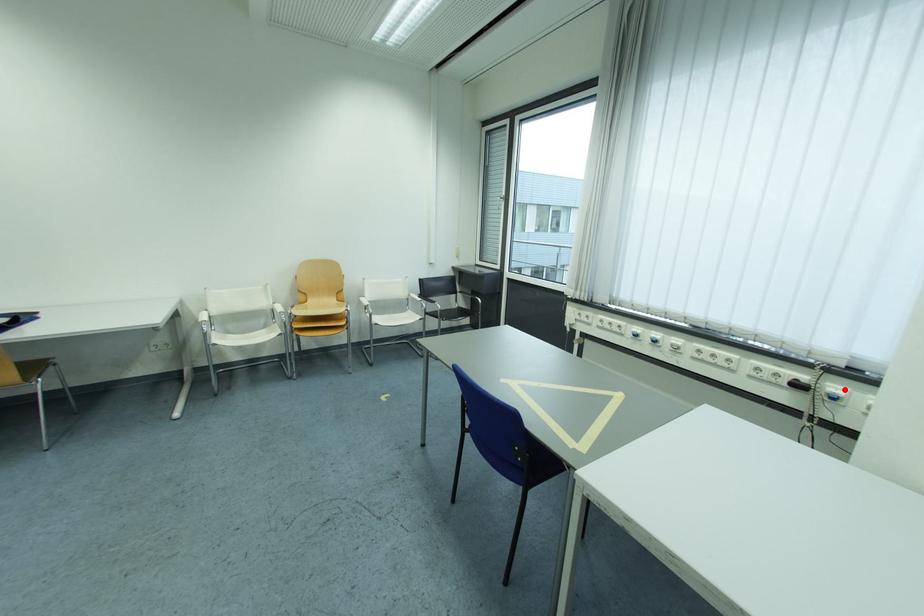
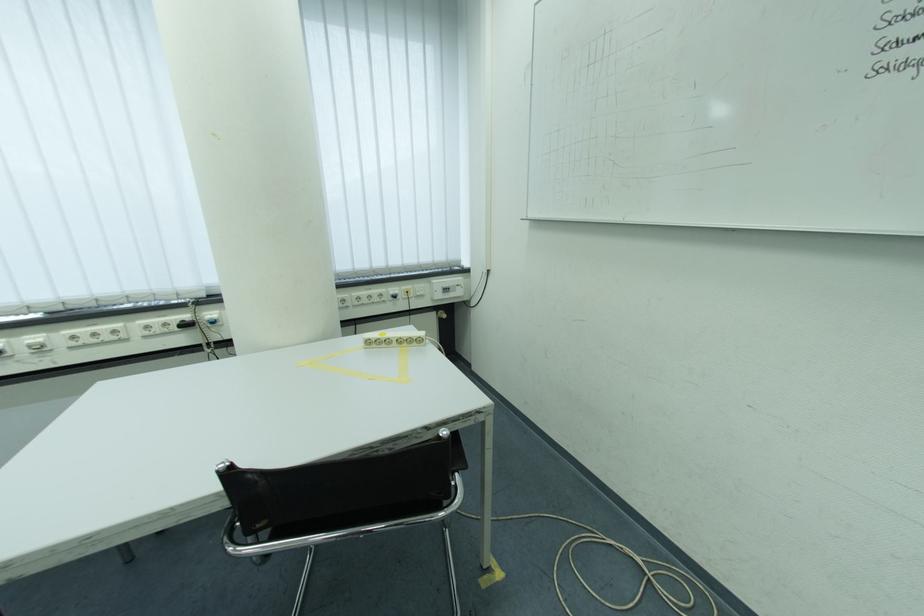
Question: I am providing you with two images of the same scene from different viewpoints. A red point is marked on the first image. At the location where the point appears in image 1, is it still visible in image 2?

Choices:
 (A) Yes
 (B) No

Answer: (A)